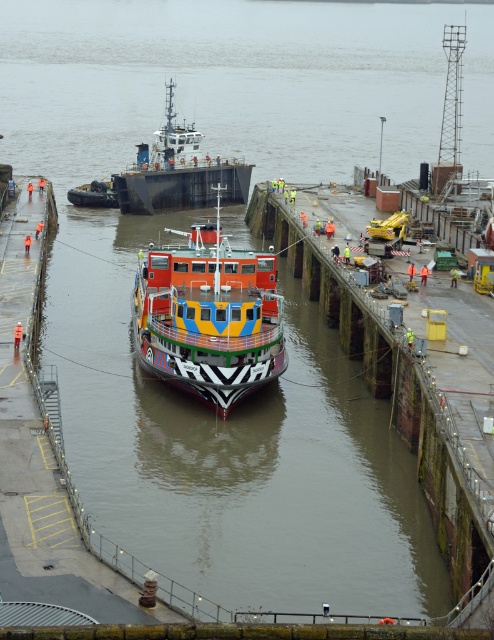
You are a dock worker who needs to secure both the multicolored painted ship at center and the metallic gray barge at center. Based on their sizes, which one requires more mooring ropes to handle the increased buoyancy?

The multicolored painted ship at center is larger in size than the metallic gray barge at center, so it requires more mooring ropes to handle its increased buoyancy.

You are a crane operator at the harbor and need to move a container from the multicolored painted ship at center to the metallic gray barge at center. Given that the crane has a maximum reach of 20 meters, can you safely perform this operation without moving the crane itself?

The distance between the multicolored painted ship at center and the metallic gray barge at center is 19.90 meters, which is within the crane operator maximum reach of 20 meters. Therefore, the container can be safely moved without moving the crane itself.